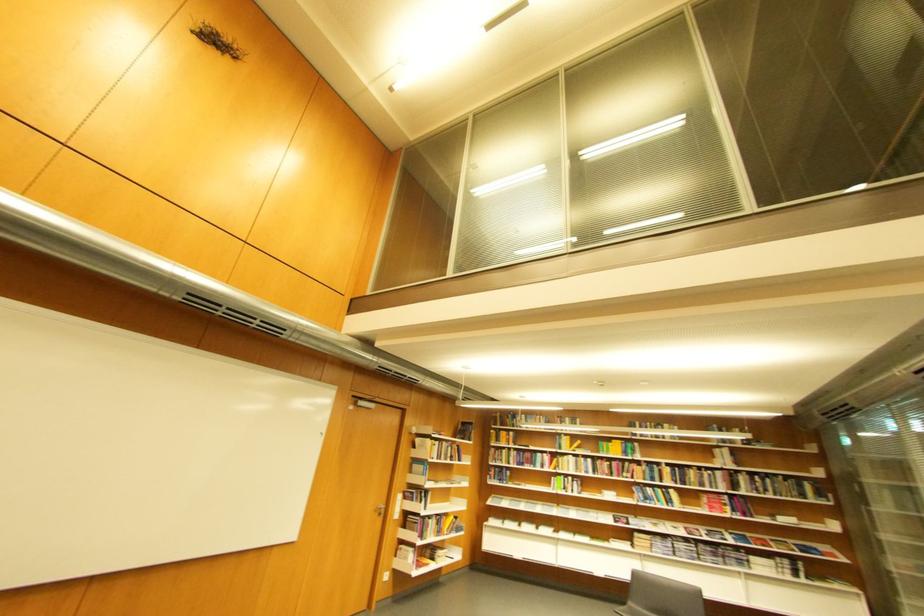
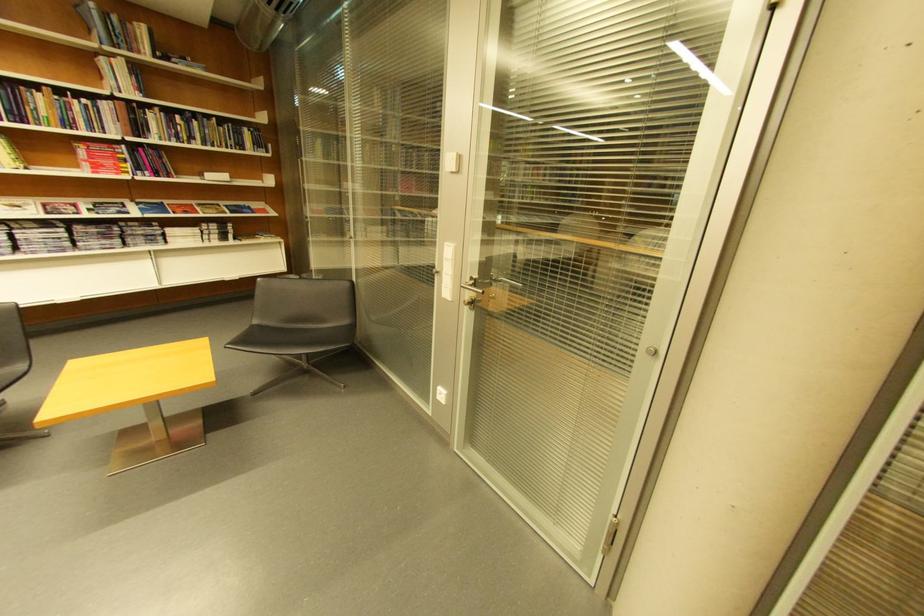
The point at (702,482) is marked in the first image. Where is the corresponding point in the second image?

(54, 116)